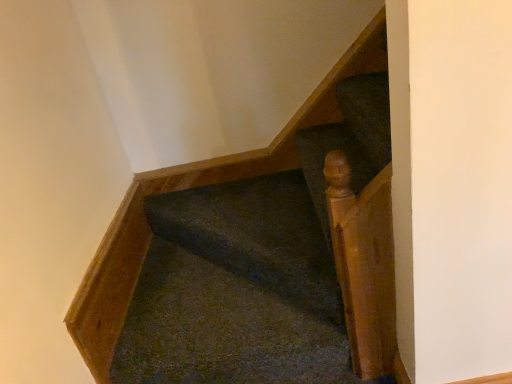
Question: From a real-world perspective, is light brown polished wood handrail at upper right located beneath dark green carpet at center?

Choices:
 (A) no
 (B) yes

Answer: (A)

Question: Does light brown polished wood handrail at upper right come in front of dark green carpet at center?

Choices:
 (A) no
 (B) yes

Answer: (B)

Question: Is light brown polished wood handrail at upper right with dark green carpet at center?

Choices:
 (A) yes
 (B) no

Answer: (B)

Question: Could you tell me if light brown polished wood handrail at upper right is facing dark green carpet at center?

Choices:
 (A) no
 (B) yes

Answer: (A)

Question: From the image's perspective, is light brown polished wood handrail at upper right above dark green carpet at center?

Choices:
 (A) no
 (B) yes

Answer: (A)

Question: Can you confirm if light brown polished wood handrail at upper right is wider than dark green carpet at center?

Choices:
 (A) yes
 (B) no

Answer: (B)

Question: Is dark green carpet at center smaller than light brown polished wood handrail at upper right?

Choices:
 (A) no
 (B) yes

Answer: (A)

Question: Considering the relative positions of dark green carpet at center and light brown polished wood handrail at upper right in the image provided, is dark green carpet at center to the left of light brown polished wood handrail at upper right from the viewer's perspective?

Choices:
 (A) yes
 (B) no

Answer: (A)

Question: Is dark green carpet at center at the right side of light brown polished wood handrail at upper right?

Choices:
 (A) no
 (B) yes

Answer: (A)

Question: Is dark green carpet at center looking in the opposite direction of light brown polished wood handrail at upper right?

Choices:
 (A) no
 (B) yes

Answer: (A)

Question: Does dark green carpet at center have a greater width compared to light brown polished wood handrail at upper right?

Choices:
 (A) yes
 (B) no

Answer: (A)

Question: Is dark green carpet at center oriented towards light brown polished wood handrail at upper right?

Choices:
 (A) yes
 (B) no

Answer: (B)

Question: Considering their positions, is light brown polished wood handrail at upper right located in front of or behind dark green carpet at center?

Choices:
 (A) behind
 (B) front

Answer: (B)